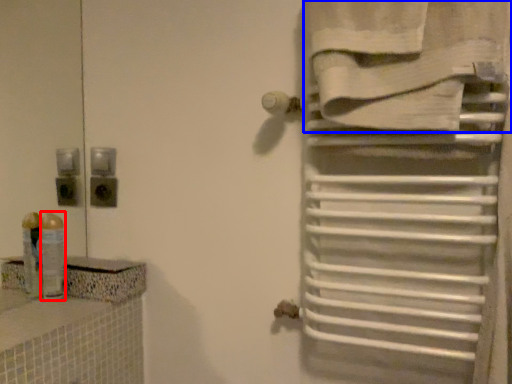
Question: Which object appears closest to the camera in this image, toiletry (highlighted by a red box) or towel (highlighted by a blue box)?

Choices:
 (A) toiletry
 (B) towel

Answer: (B)